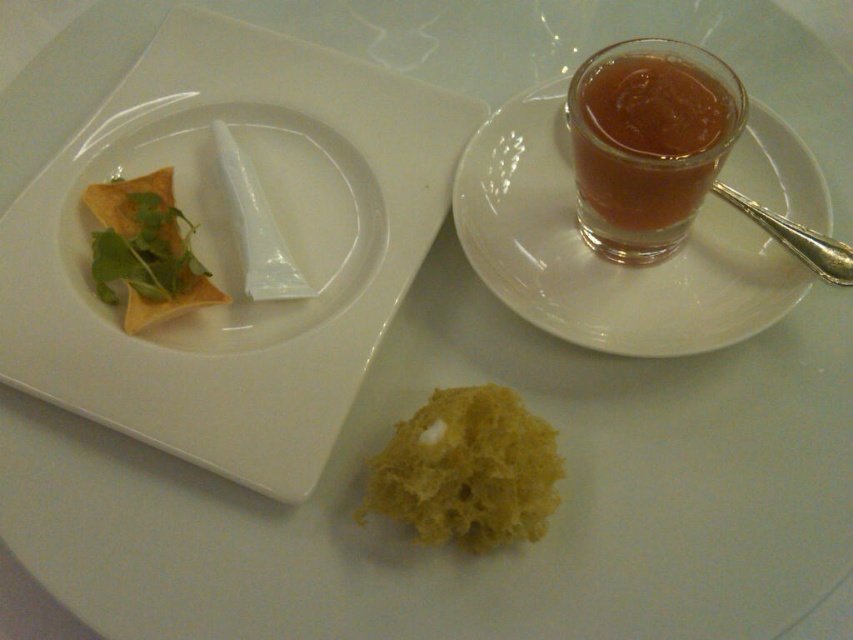
Question: Is white glossy plate at upper left smaller than matte yellow tortilla at upper left?

Choices:
 (A) no
 (B) yes

Answer: (A)

Question: Which point is farther to the camera?

Choices:
 (A) transparent glass saucer at upper right
 (B) matte yellow tortilla at upper left
 (C) yellow sponge at center

Answer: (B)

Question: Among these points, which one is nearest to the camera?

Choices:
 (A) (105, 150)
 (B) (189, 230)

Answer: (B)

Question: Does transparent glass saucer at upper right lie behind matte yellow tortilla at upper left?

Choices:
 (A) no
 (B) yes

Answer: (A)

Question: Based on their relative distances, which object is nearer to the translucent amber liquid at upper right?

Choices:
 (A) matte yellow tortilla at upper left
 (B) yellow sponge at center
 (C) transparent glass saucer at upper right
 (D) white glossy plate at upper left

Answer: (C)

Question: Can you confirm if white glossy plate at upper left is wider than transparent glass saucer at upper right?

Choices:
 (A) no
 (B) yes

Answer: (B)